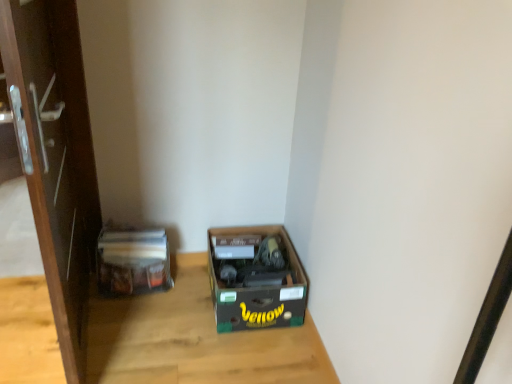
The height and width of the screenshot is (384, 512). What are the coordinates of `vacant area that is in front of matte plastic bag at left` in the screenshot? It's located at (128, 322).